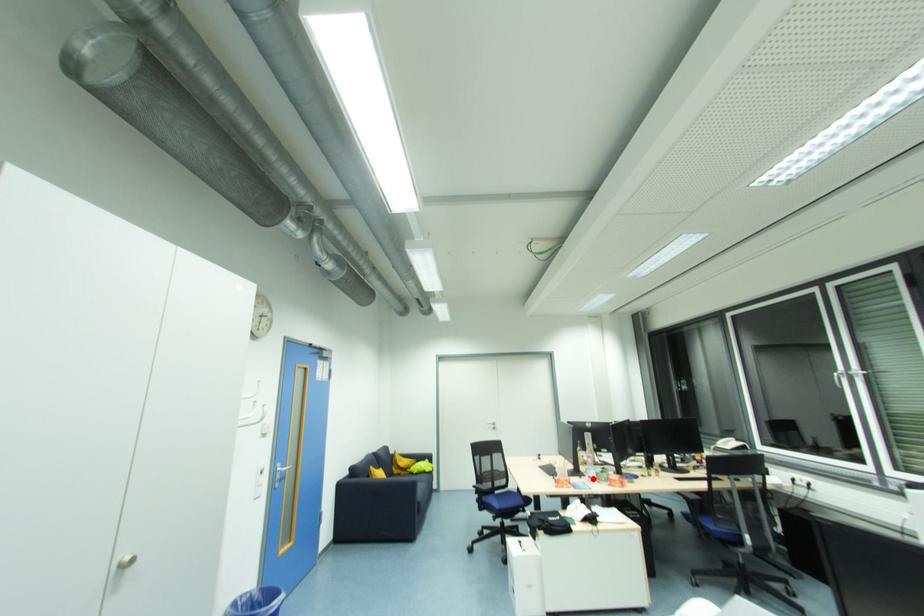
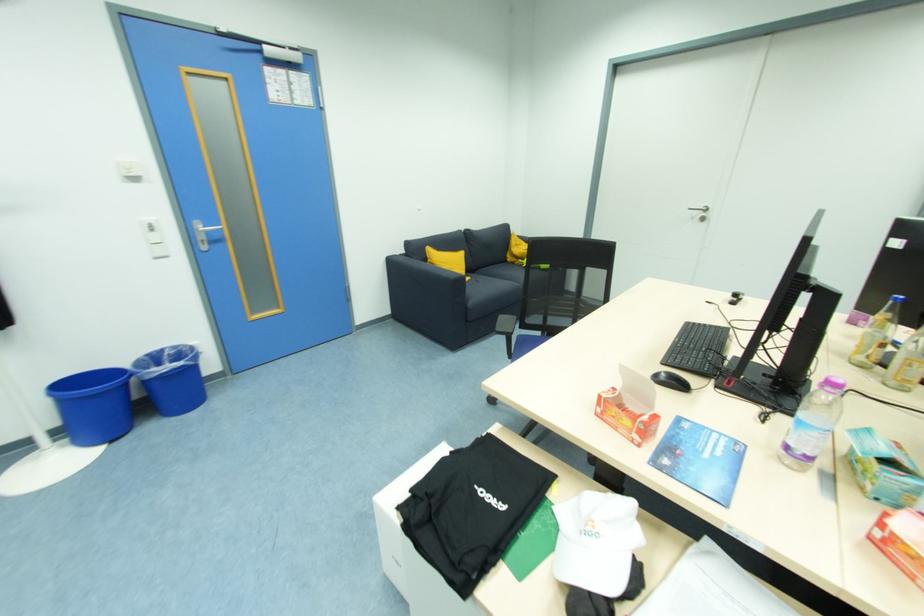
Locate, in the second image, the point that corresponds to the highlighted location in the first image.

(792, 448)